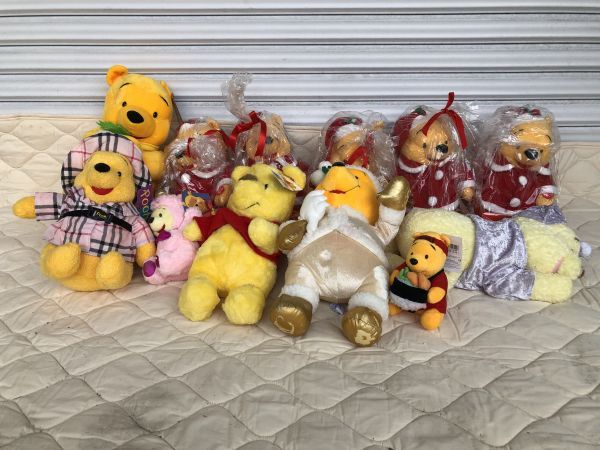
At what (x,y) coordinates should I click in order to perform the action: click on top row of pooh bear plushies. Please return your answer as a coordinate pair (x, y). The width and height of the screenshot is (600, 450). Looking at the image, I should click on pos(142,118), pos(203,153), pos(271,142), pos(343,141), pos(445,157), pos(519,157).